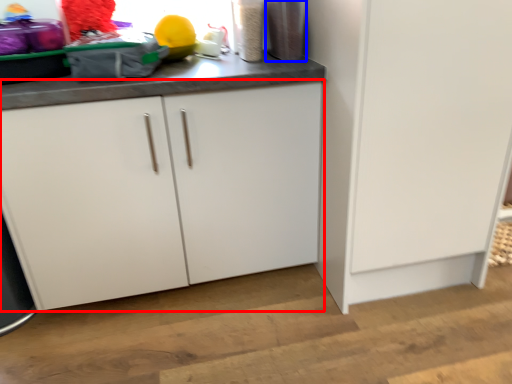
Question: Which object appears closest to the camera in this image, cabinetry (highlighted by a red box) or appliance (highlighted by a blue box)?

Choices:
 (A) cabinetry
 (B) appliance

Answer: (A)